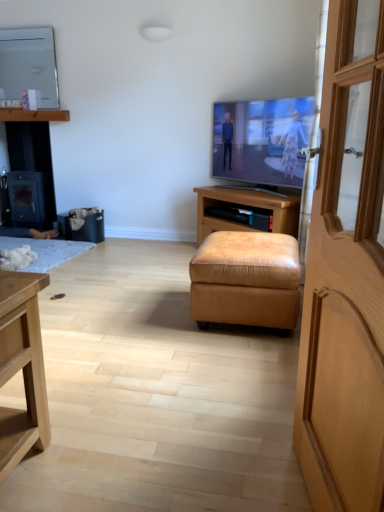
The image size is (384, 512). Identify the location of vacant space in front of tan leather ottoman at center. (228, 361).